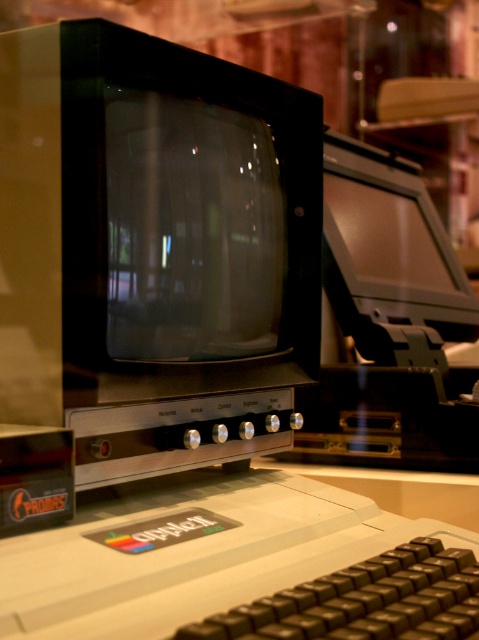
Is point (213, 483) more distant than point (407, 358)?

That is False.

Does white plastic keyboard at lower center appear over matte black monitor at upper right?

Incorrect, white plastic keyboard at lower center is not positioned above matte black monitor at upper right.

Between point (385, 579) and point (360, 173), which one is positioned in front?

Point (385, 579) is in front.

Where is `white plastic keyboard at lower center`? This screenshot has width=479, height=640. white plastic keyboard at lower center is located at coordinates (235, 564).

Who is lower down, white plastic keyboard at lower center or black plastic keyboard at lower center?

black plastic keyboard at lower center is below.

Which is more to the left, white plastic keyboard at lower center or black plastic keyboard at lower center?

Positioned to the left is white plastic keyboard at lower center.

This screenshot has width=479, height=640. In order to click on white plastic keyboard at lower center in this screenshot , I will do `click(235, 564)`.

Is matte black monitor at upper right bigger than black plastic keyboard at lower center?

Indeed, matte black monitor at upper right has a larger size compared to black plastic keyboard at lower center.

Between point (454, 294) and point (463, 627), which one is positioned behind?

Point (454, 294)

The width and height of the screenshot is (479, 640). I want to click on matte black monitor at upper right, so click(389, 259).